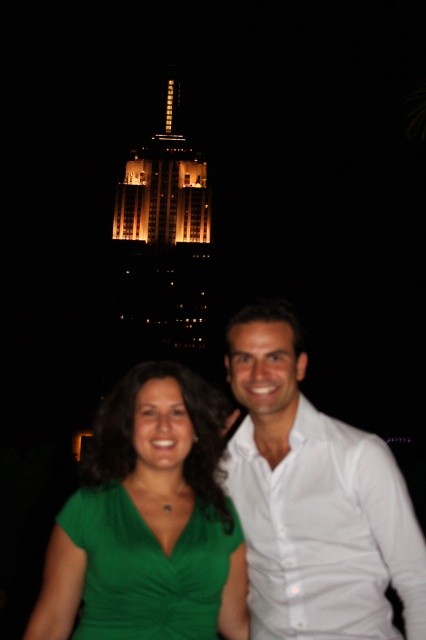
Who is taller, green fabric shirt at center or illuminated glass tower at upper center?

With more height is illuminated glass tower at upper center.

Locate an element on the screen. The height and width of the screenshot is (640, 426). green fabric shirt at center is located at coordinates (161, 449).

Is point (137, 392) less distant than point (109, 257)?

Yes, it is.

This screenshot has width=426, height=640. I want to click on green fabric shirt at center, so point(161,449).

Does white smooth shirt at center have a lesser width compared to green fabric shirt at center?

Indeed, white smooth shirt at center has a lesser width compared to green fabric shirt at center.

Between point (241, 486) and point (77, 560), which one is positioned in front?

Point (77, 560) is more forward.

Who is more forward, [354,602] or [60,611]?

Point [354,602]

Where is `white smooth shirt at center`? white smooth shirt at center is located at coordinates (313, 500).

Between point (172, 218) and point (201, 545), which one is positioned in front?

Point (201, 545)

This screenshot has height=640, width=426. What are the coordinates of `illuminated glass tower at upper center` in the screenshot? It's located at coord(161,250).

Find the location of a particular element. This screenshot has width=426, height=640. illuminated glass tower at upper center is located at coordinates (161, 250).